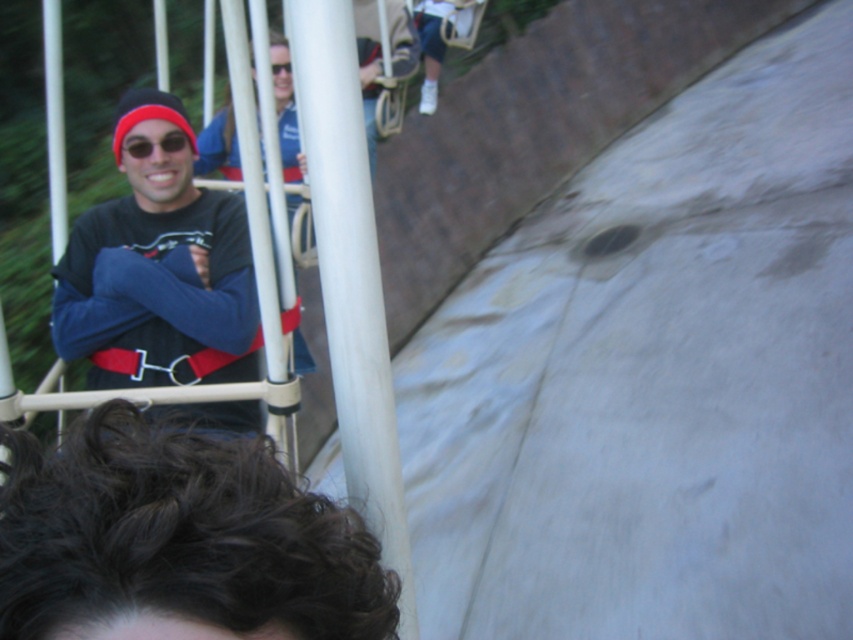
Question: Is dark brown hair at upper left positioned behind matte black shirt at left?

Choices:
 (A) no
 (B) yes

Answer: (A)

Question: Among these points, which one is farthest from the camera?

Choices:
 (A) (96, 506)
 (B) (236, 257)

Answer: (B)

Question: Which point is farther to the camera?

Choices:
 (A) (88, 621)
 (B) (90, 228)

Answer: (B)

Question: Is dark brown hair at upper left closer to the viewer compared to matte black shirt at left?

Choices:
 (A) no
 (B) yes

Answer: (B)

Question: Is dark brown hair at upper left below matte black shirt at left?

Choices:
 (A) no
 (B) yes

Answer: (B)